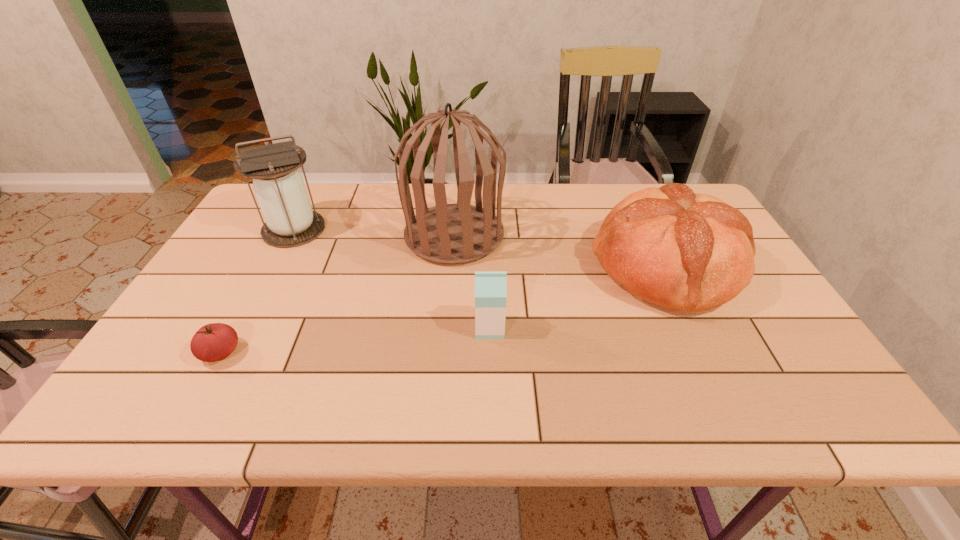
The height and width of the screenshot is (540, 960). Find the location of `birdcage`. birdcage is located at coordinates (458, 233).

Locate an element on the screen. This screenshot has height=540, width=960. lantern is located at coordinates (289, 220).

Where is `the rightmost object`? the rightmost object is located at coordinates (689, 252).

In order to click on bread in this screenshot , I will do `click(689, 252)`.

Identify the location of milk carton. (490, 287).

I want to click on tomato, so click(212, 342).

What are the coordinates of `free space located on the front of the birdcage` in the screenshot? It's located at (445, 360).

Image resolution: width=960 pixels, height=540 pixels. I want to click on free location located on the right of the fourth shortest object, so click(x=354, y=230).

Where is `free location located 0.080m on the back of the third shortest object`? free location located 0.080m on the back of the third shortest object is located at coordinates (637, 208).

Find the location of a particular element. Image resolution: width=960 pixels, height=540 pixels. vacant space located 0.160m on the left of the second shortest object is located at coordinates (408, 328).